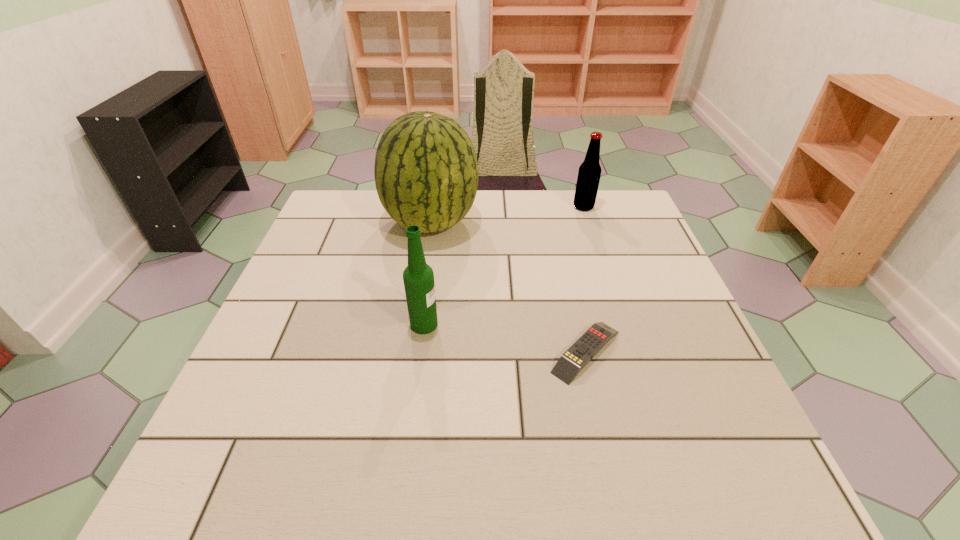
Locate an element on the screen. This screenshot has height=540, width=960. object present at the right edge is located at coordinates (589, 173).

Image resolution: width=960 pixels, height=540 pixels. I want to click on object positioned at the far right corner, so click(x=589, y=173).

You are a GUI agent. You are given a task and a screenshot of the screen. Output one action in this format:
    pyautogui.click(x=<x>, y=<y>)
    Task: Click on the free space at the far edge of the desktop
    This screenshot has height=540, width=960.
    Given the screenshot: What is the action you would take?
    pyautogui.click(x=443, y=231)

The height and width of the screenshot is (540, 960). In the image, there is a desktop. Find the location of `free space at the near edge`. free space at the near edge is located at coordinates (440, 464).

Locate an element on the screen. vacant space at the left edge of the desktop is located at coordinates (283, 377).

Image resolution: width=960 pixels, height=540 pixels. What are the coordinates of `free region at the right edge of the desktop` in the screenshot? It's located at (649, 254).

Identify the location of vacant area at the far left corner. Image resolution: width=960 pixels, height=540 pixels. (371, 224).

Locate an element on the screen. This screenshot has height=540, width=960. vacant area at the near left corner is located at coordinates (185, 493).

Identify the location of vacant area at the far right corner. (631, 210).

Locate an element on the screen. The image size is (960, 540). free spot between the shortest object and the left beer bottle is located at coordinates (505, 338).